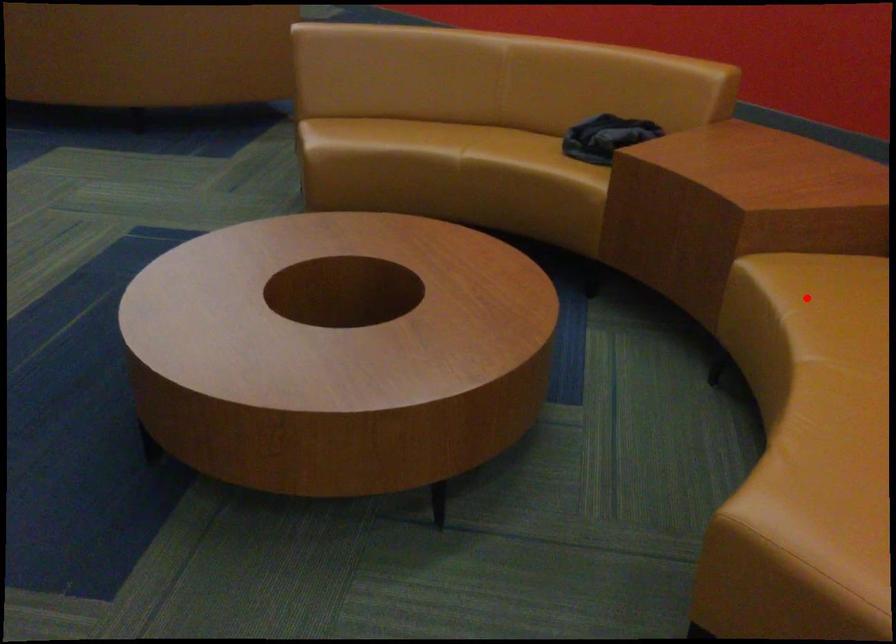
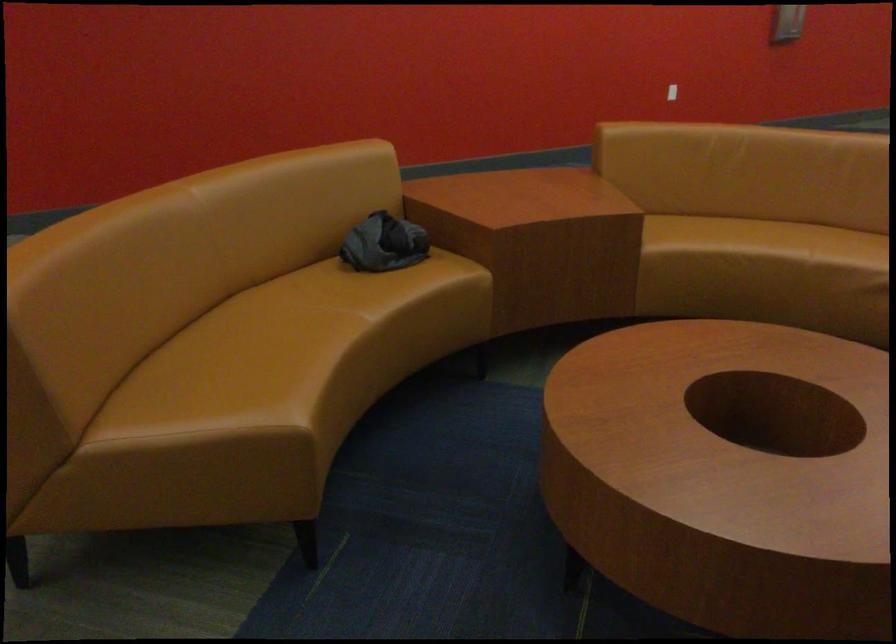
Where in the second image is the point corresponding to the highlighted location from the first image?

(719, 242)